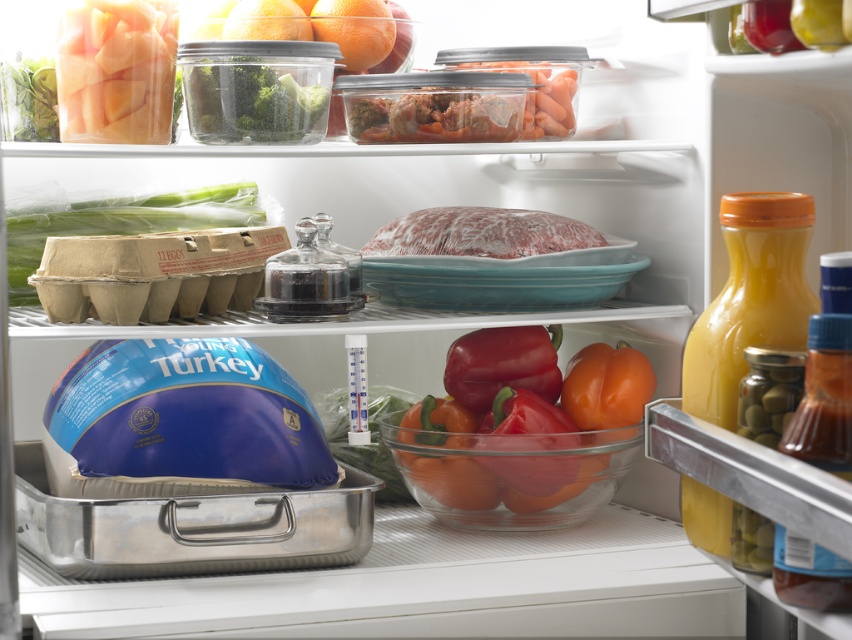
Which is above, green cardboard egg carton at left or translucent plastic broccoli at upper left?

Positioned higher is translucent plastic broccoli at upper left.

Between point (81, 218) and point (208, 93), which one is positioned in front?

Positioned in front is point (208, 93).

Find the location of a particular element. green cardboard egg carton at left is located at coordinates (116, 220).

Does translucent glass bell peppers at center appear under yellow glass bottle at right?

Indeed, translucent glass bell peppers at center is positioned under yellow glass bottle at right.

Measure the distance from translucent glass bell peppers at center to yellow glass bottle at right.

A distance of 33.64 centimeters exists between translucent glass bell peppers at center and yellow glass bottle at right.

Describe the element at coordinates (525, 435) in the screenshot. I see `translucent glass bell peppers at center` at that location.

Locate an element on the screen. This screenshot has height=640, width=852. translucent glass bell peppers at center is located at coordinates (525, 435).

Does translucent plastic peaches at upper left appear on the left side of translucent plastic broccoli at upper left?

Indeed, translucent plastic peaches at upper left is positioned on the left side of translucent plastic broccoli at upper left.

Is the position of translucent plastic peaches at upper left less distant than that of translucent plastic broccoli at upper left?

Yes, it is in front of translucent plastic broccoli at upper left.

Find the location of a particular element. This screenshot has height=640, width=852. translucent plastic peaches at upper left is located at coordinates (116, 70).

Identify the location of translucent plastic peaches at upper left. (116, 70).